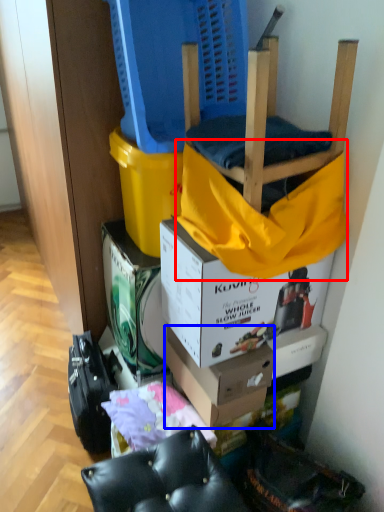
Question: Which object appears farthest to the camera in this image, blanket (highlighted by a red box) or box (highlighted by a blue box)?

Choices:
 (A) blanket
 (B) box

Answer: (B)